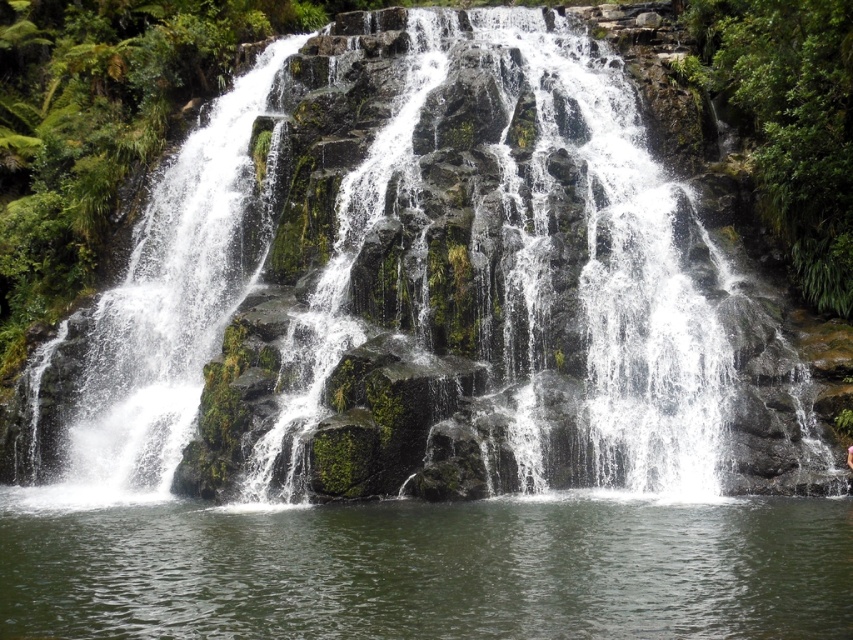
Does point (473, 621) lie behind point (851, 451)?

No, (473, 621) is in front of (851, 451).

Between clear water at bottom and pink fabric at center, which one is positioned higher?

Positioned higher is pink fabric at center.

Is point (352, 624) behind point (850, 444)?

That is False.

At what (x,y) coordinates should I click in order to perform the action: click on clear water at bottom. Please return your answer as a coordinate pair (x, y). The width and height of the screenshot is (853, 640). Looking at the image, I should click on 431,570.